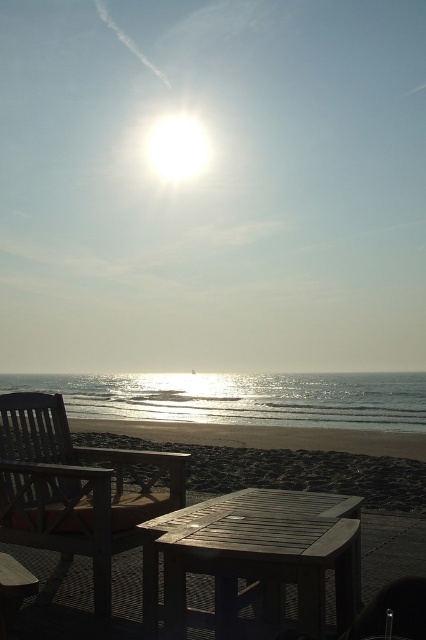
Which of these two, wooden slats chair at lower left or shiny metallic water at lower center, stands taller?

Standing taller between the two is shiny metallic water at lower center.

Based on the photo, can you confirm if wooden slats chair at lower left is taller than shiny metallic water at lower center?

No, wooden slats chair at lower left is not taller than shiny metallic water at lower center.

The height and width of the screenshot is (640, 426). What do you see at coordinates (74, 488) in the screenshot?
I see `wooden slats chair at lower left` at bounding box center [74, 488].

At what (x,y) coordinates should I click in order to perform the action: click on wooden slats chair at lower left. Please return your answer as a coordinate pair (x, y). The width and height of the screenshot is (426, 640). Looking at the image, I should click on (74, 488).

Between wooden picnic table at center and shiny metallic water at lower center, which one is positioned lower?

shiny metallic water at lower center

Does wooden picnic table at center have a larger size compared to shiny metallic water at lower center?

Actually, wooden picnic table at center might be smaller than shiny metallic water at lower center.

Locate an element on the screen. The image size is (426, 640). wooden picnic table at center is located at coordinates (253, 561).

Is wooden slats chair at lower left to the right of wooden table at center from the viewer's perspective?

Indeed, wooden slats chair at lower left is positioned on the right side of wooden table at center.

Where is `wooden slats chair at lower left`? The width and height of the screenshot is (426, 640). wooden slats chair at lower left is located at coordinates (74, 488).

This screenshot has width=426, height=640. Identify the location of wooden slats chair at lower left. click(74, 488).